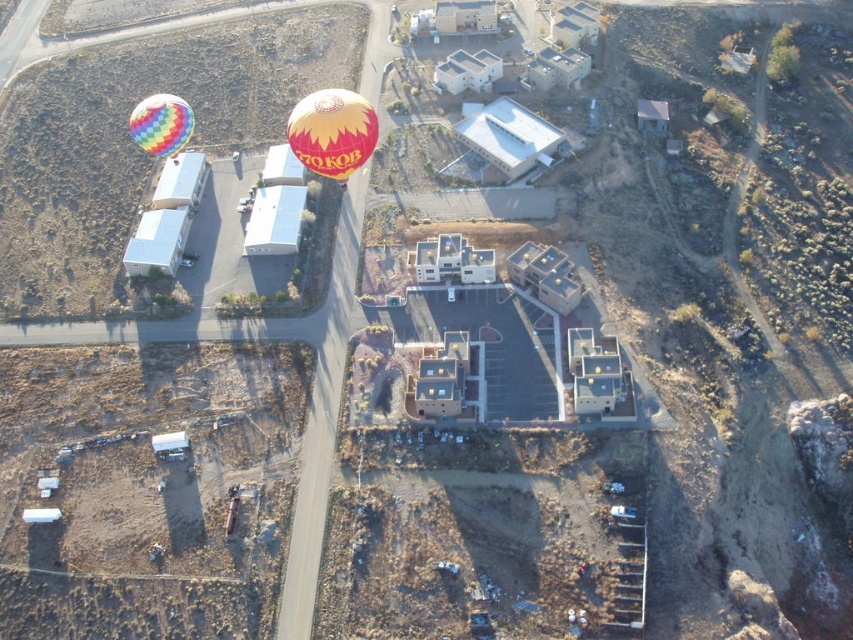
Image resolution: width=853 pixels, height=640 pixels. Describe the element at coordinates (332, 132) in the screenshot. I see `yellow and orange fabric balloon at center` at that location.

Between yellow and orange fabric balloon at center and rainbow striped balloon at upper left, which one has less height?

rainbow striped balloon at upper left

Does point (352, 104) come behind point (161, 152)?

No, (352, 104) is closer to viewer.

Locate an element on the screen. This screenshot has width=853, height=640. yellow and orange fabric balloon at center is located at coordinates (332, 132).